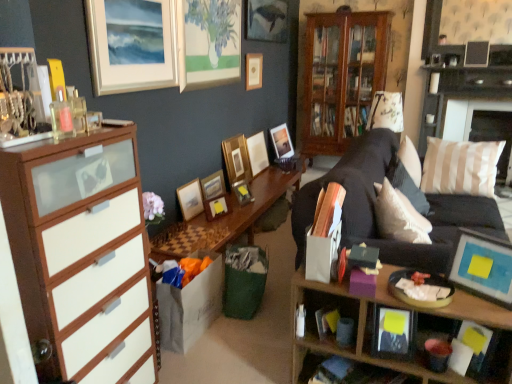
Where is `vacant point above wooden shelf at lower right (from a real-world perspective)`? Image resolution: width=512 pixels, height=384 pixels. vacant point above wooden shelf at lower right (from a real-world perspective) is located at coordinates (422, 289).